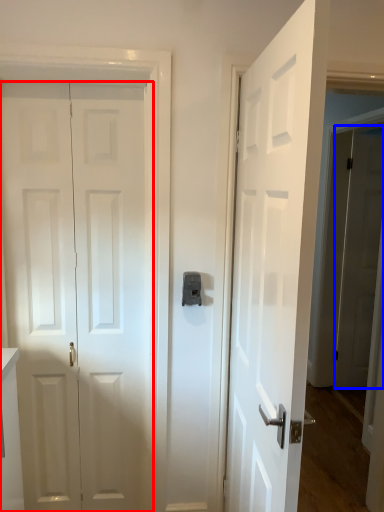
Question: Which object is closer to the camera taking this photo, door (highlighted by a red box) or door (highlighted by a blue box)?

Choices:
 (A) door
 (B) door

Answer: (A)